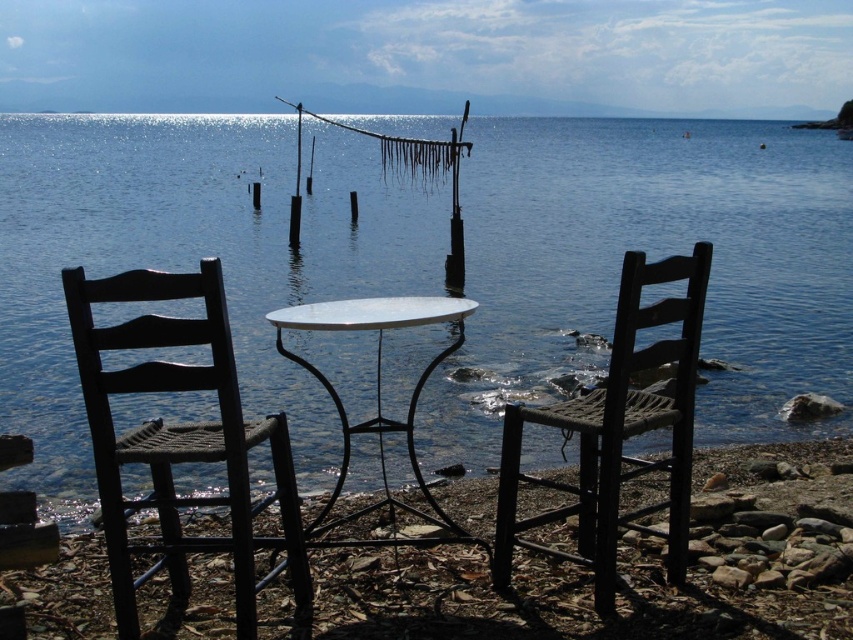
Question: Is woven wood chair at center to the right of white marble table at center from the viewer's perspective?

Choices:
 (A) no
 (B) yes

Answer: (B)

Question: Estimate the real-world distances between objects in this image. Which object is closer to the blue water at center?

Choices:
 (A) woven wood chair at center
 (B) rustic wood table at center
 (C) matte black chair at left
 (D) white marble table at center

Answer: (C)

Question: Which object is the closest to the rustic wood table at center?

Choices:
 (A) matte black chair at left
 (B) blue water at center
 (C) woven wood chair at center

Answer: (C)

Question: Is blue water at center positioned behind rustic wood table at center?

Choices:
 (A) yes
 (B) no

Answer: (B)

Question: Does woven wood chair at center appear on the right side of white marble table at center?

Choices:
 (A) yes
 (B) no

Answer: (A)

Question: Which point is farther to the camera?

Choices:
 (A) (x=836, y=154)
 (B) (x=839, y=520)
 (C) (x=416, y=388)

Answer: (A)